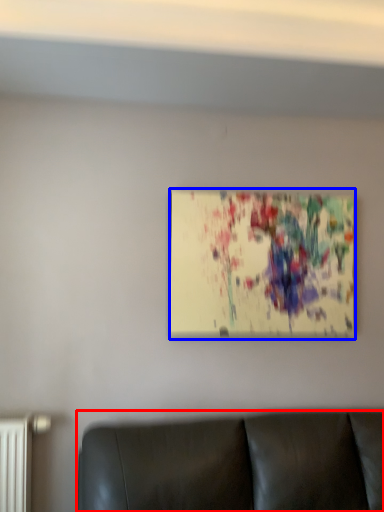
Question: Which point is further to the camera, furniture (highlighted by a red box) or picture frame (highlighted by a blue box)?

Choices:
 (A) furniture
 (B) picture frame

Answer: (B)